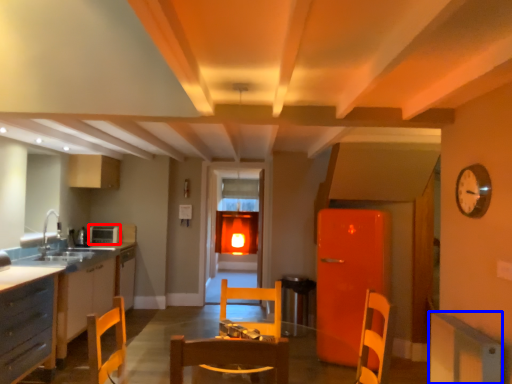
Question: Which object is closer to the camera taking this photo, appliance (highlighted by a red box) or cabinetry (highlighted by a blue box)?

Choices:
 (A) appliance
 (B) cabinetry

Answer: (B)